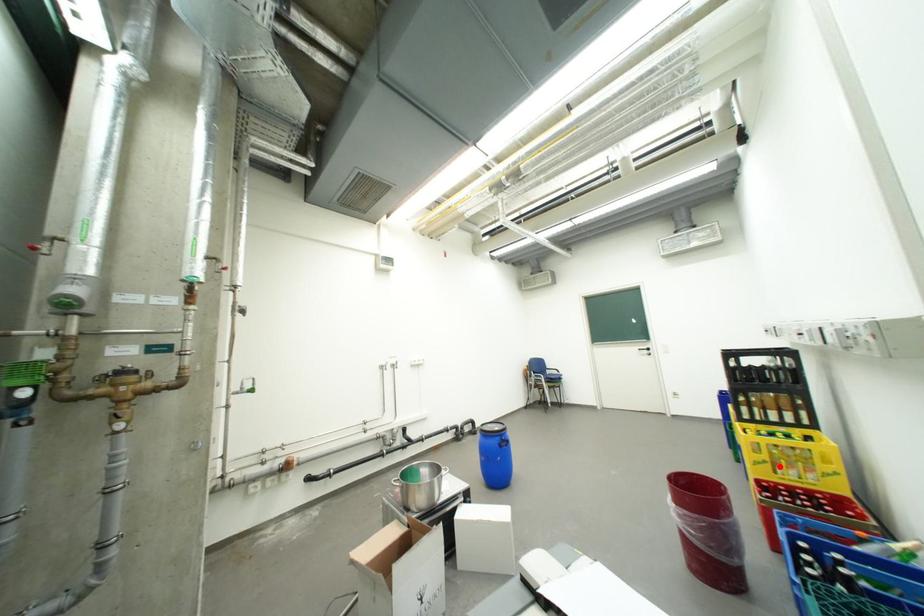
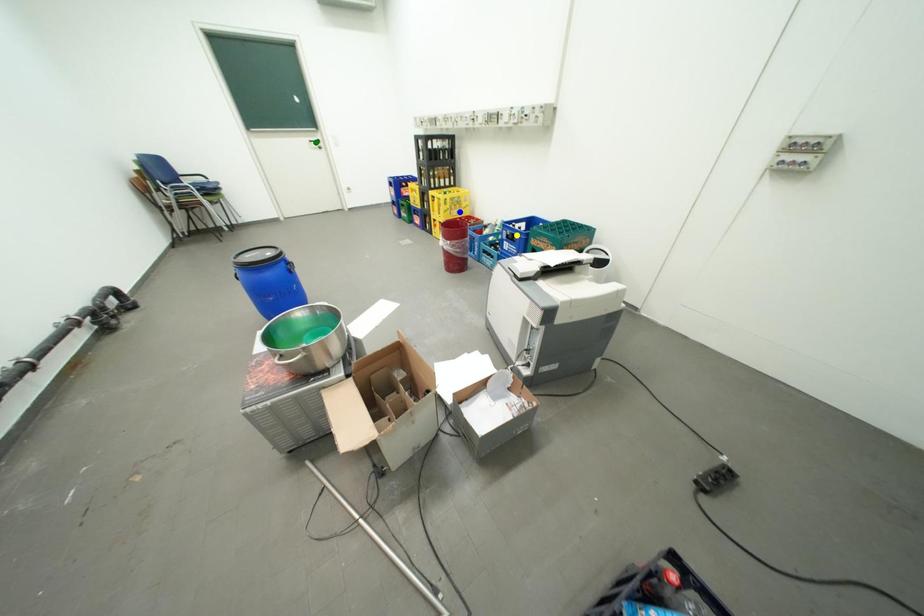
Question: I am providing you with two images of the same scene from different viewpoints. A red point is marked on the first image. You are given multiple points on the second image. Can you choose the point in image 2 that corresponds to the point in image 1?

Choices:
 (A) blue point
 (B) green point
 (C) yellow point

Answer: (A)